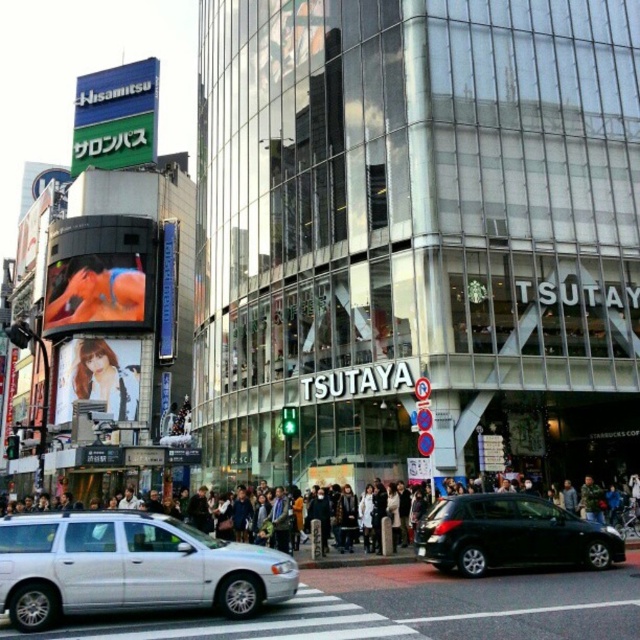
Based on the photo, you are standing at the center of the street in this urban scene. You notice a dark gray concrete crowd at center. Where exactly is the dark gray concrete crowd located in relation to the TSUTAYA building and the Hisamitsu Salonpas billboard?

The dark gray concrete crowd at center is located at point coordinates of (365, 557), which places it near the center of the image. Based on the scene description, this position would place the crowd between the TSUTAYA building and the Hisamitsu Salonpas billboard to the left, but closer to the TSUTAYA building since the coordinates are towards the right side of the image.

Looking at this image, you are a delivery driver approaching the TSUTAYA building and need to park your silver metallic station wagon at center. There is a dark gray concrete crowd at center nearby. Based on the scene, can you park your vehicle to the right of the crowd?

Yes, the silver metallic station wagon at center is positioned to the right of the dark gray concrete crowd at center, so parking there should be possible.

You are a delivery person standing at the entrance of the TSUTAYA building. You need to park your delivery van, which is 5 meters long, in the street. The parking spot you found is directly in front of the Hisamitsu Salonpas billboard. Is there enough space for your van between the silver metallic station wagon at center and the building entrance?

The silver metallic station wagon at center is located at point [129,566]. Since the parking spot is directly in front of the Hisamitsu Salonpas billboard, which is to the left of the TSUTAYA building, the distance between the station wagon and the building entrance must be calculated. However, without specific spatial measurements between these points, it is impossible to determine if the 5 meter van will fit. Please check the exact distance between the silver metallic station wagon at center and the TS